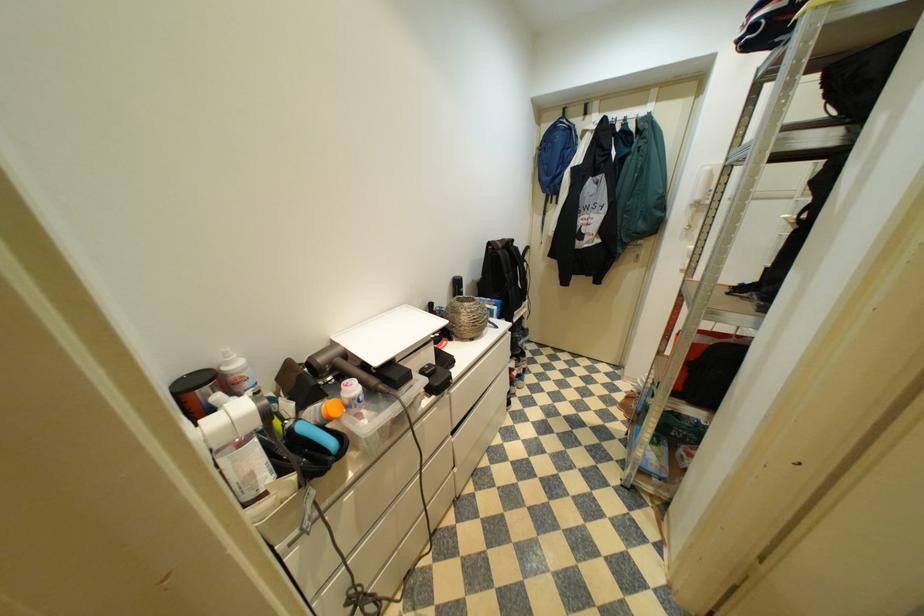
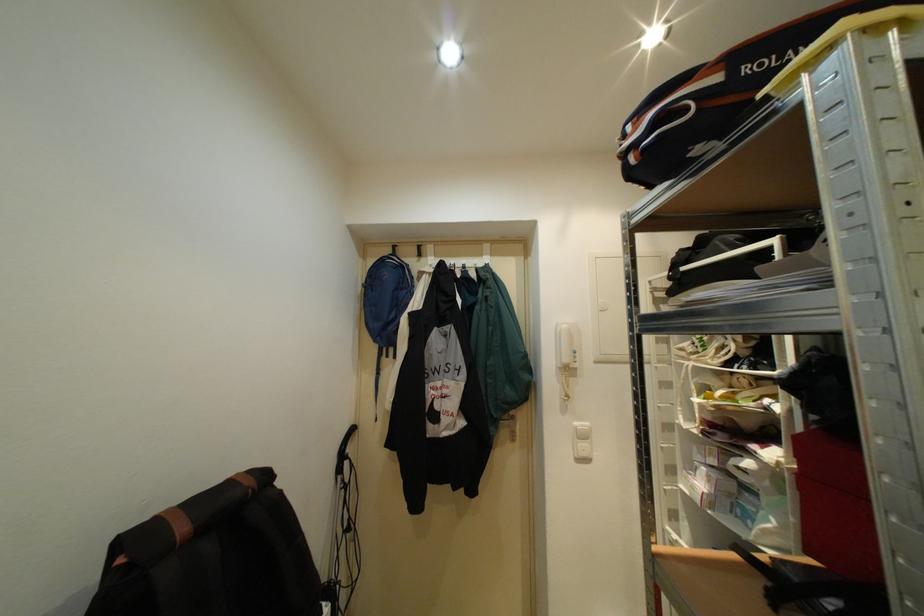
First-person continuous shooting, in which direction is the camera rotating?

The camera rotated toward right-up.